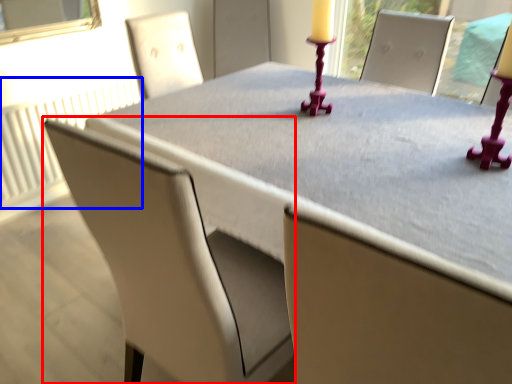
Question: Which point is closer to the camera, chair (highlighted by a red box) or radiator (highlighted by a blue box)?

Choices:
 (A) chair
 (B) radiator

Answer: (A)